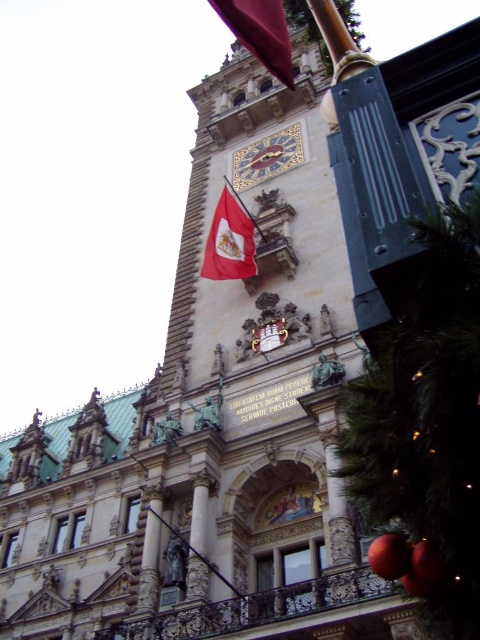
You are standing in front of the grand building and notice two flags. Which flag is positioned to the left when looking at the matte red flag at upper center and the red fabric flag at center?

The matte red flag at upper center is positioned to the left of the red fabric flag at center.

You are an architect reviewing the building facade. You need to determine which object, the red fabric flag at center or the gold mosaic clock at center, occupies more space on the facade. Which one is larger?

The red fabric flag at center is bigger than the gold mosaic clock at center, so the red fabric flag at center occupies more space on the facade.

You are an architect designing a new building inspired by this historic structure. You need to ensure that the red fabric flag at center and the gold mosaic clock at center maintain their proportional relationship as seen in the original. Which object should you make wider if you want to keep the same proportions but increase the overall size of both?

Since the red fabric flag at center is narrower than the gold mosaic clock at center in the original design, to maintain their proportional relationship while increasing the overall size, you should make the gold mosaic clock at center wider. This ensures that the flag remains proportionally smaller relative to the clock.